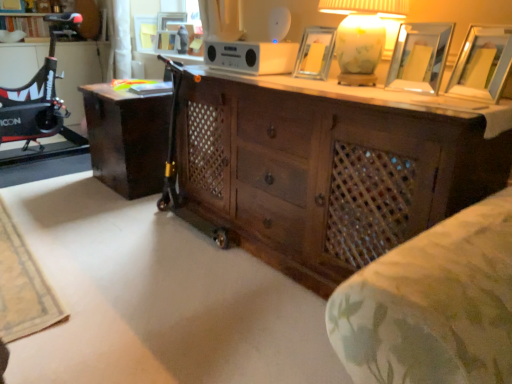
Question: Is dark wood desk at center positioned in front of wooden picture frame at upper right, which ranks as the fifth picture frame in left-to-right order?

Choices:
 (A) yes
 (B) no

Answer: (B)

Question: From a real-world perspective, does dark wood desk at center stand above wooden picture frame at upper right, acting as the 1th picture frame starting from the bottom?

Choices:
 (A) no
 (B) yes

Answer: (A)

Question: Considering the relative positions of dark wood desk at center and wooden picture frame at upper right, which is the 1th picture frame from front to back, in the image provided, is dark wood desk at center to the right of wooden picture frame at upper right, which is the 1th picture frame from front to back, from the viewer's perspective?

Choices:
 (A) yes
 (B) no

Answer: (B)

Question: From the image's perspective, does dark wood desk at center appear lower than wooden picture frame at upper right, which is the 1th picture frame from front to back?

Choices:
 (A) yes
 (B) no

Answer: (A)

Question: Is dark wood desk at center in contact with wooden picture frame at upper right, positioned as the 5th picture frame in top-to-bottom order?

Choices:
 (A) no
 (B) yes

Answer: (A)

Question: Is matte glass table lamp at upper right bigger or smaller than wooden picture frame at upper center, which is counted as the fourth picture frame, starting from the right?

Choices:
 (A) small
 (B) big

Answer: (B)

Question: Looking at their shapes, would you say matte glass table lamp at upper right is wider or thinner than wooden picture frame at upper center, the 4th picture frame in the front-to-back sequence?

Choices:
 (A) thin
 (B) wide

Answer: (B)

Question: Does point pyautogui.click(x=373, y=54) appear closer or farther from the camera than point pyautogui.click(x=164, y=48)?

Choices:
 (A) closer
 (B) farther

Answer: (A)

Question: From their relative heights in the image, would you say matte glass table lamp at upper right is taller or shorter than wooden picture frame at upper center, which is counted as the second picture frame, starting from the left?

Choices:
 (A) tall
 (B) short

Answer: (A)

Question: Is wooden picture frame at upper right, which ranks as the fifth picture frame in left-to-right order, bigger or smaller than dark wood chest of drawers at center?

Choices:
 (A) big
 (B) small

Answer: (B)

Question: Is wooden picture frame at upper right, which is the 1th picture frame from front to back, in front of or behind dark wood chest of drawers at center in the image?

Choices:
 (A) front
 (B) behind

Answer: (B)

Question: Do you think wooden picture frame at upper right, acting as the 1th picture frame starting from the right, is within dark wood chest of drawers at center, or outside of it?

Choices:
 (A) inside
 (B) outside

Answer: (B)

Question: In terms of width, does wooden picture frame at upper right, arranged as the fifth picture frame when viewed from the back, look wider or thinner when compared to dark wood chest of drawers at center?

Choices:
 (A) wide
 (B) thin

Answer: (B)

Question: Is dark wood chest of drawers at center wider or thinner than metallic silver picture frame at upper right, which is counted as the second picture frame, starting from the bottom?

Choices:
 (A) thin
 (B) wide

Answer: (B)

Question: Is point (377, 249) positioned closer to the camera than point (437, 92)?

Choices:
 (A) farther
 (B) closer

Answer: (A)